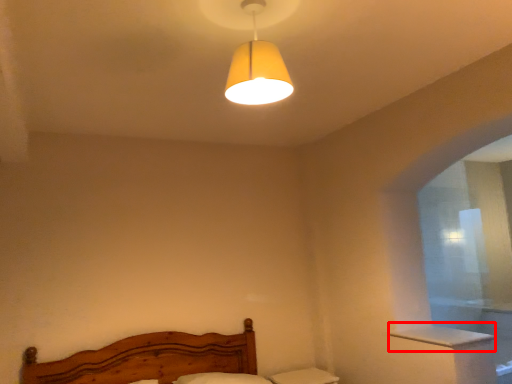
Question: From the image's perspective, what is the correct spatial relationship of window sill (annotated by the red box) in relation to lamp?

Choices:
 (A) above
 (B) below

Answer: (B)